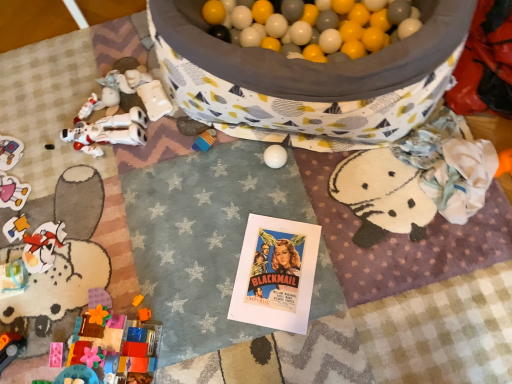
Question: Is point (78, 332) closer or farther from the camera than point (20, 155)?

Choices:
 (A) closer
 (B) farther

Answer: (A)

Question: Do you think brick-like plastic blocks at lower left, which is counted as the 2th toy, starting from the bottom, is within plastic toy car at lower left, placed as the fourth toy when sorted from front to back, or outside of it?

Choices:
 (A) outside
 (B) inside

Answer: (A)

Question: Estimate the real-world distances between objects in this image. Which object is closer to the orange plastic car at lower left, positioned as the fourth toy in top-to-bottom order?

Choices:
 (A) brick-like plastic blocks at lower left, which appears as the 4th toy when viewed from the back
 (B) white matte robot at left, which is the first toy in top-to-bottom order
 (C) plastic toy car at lower left, which ranks as the 3th toy in bottom-to-top order

Answer: (A)

Question: Which is nearer to the plastic toy car at lower left, the 1th toy positioned from the back?

Choices:
 (A) orange plastic car at lower left, the 2th toy viewed from the front
 (B) white matte robot at left, which is the first toy in top-to-bottom order
 (C) brick-like plastic blocks at lower left, which is counted as the 2th toy, starting from the bottom

Answer: (B)